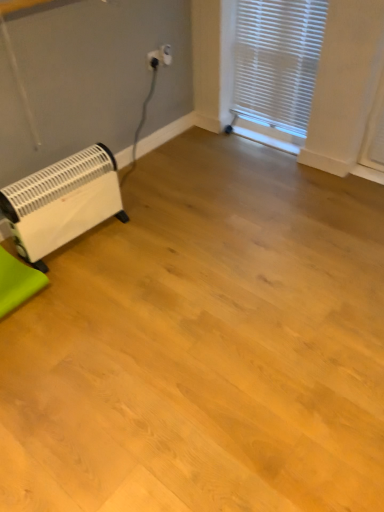
The width and height of the screenshot is (384, 512). I want to click on vacant area that lies in front of green fabric at lower left, so click(29, 343).